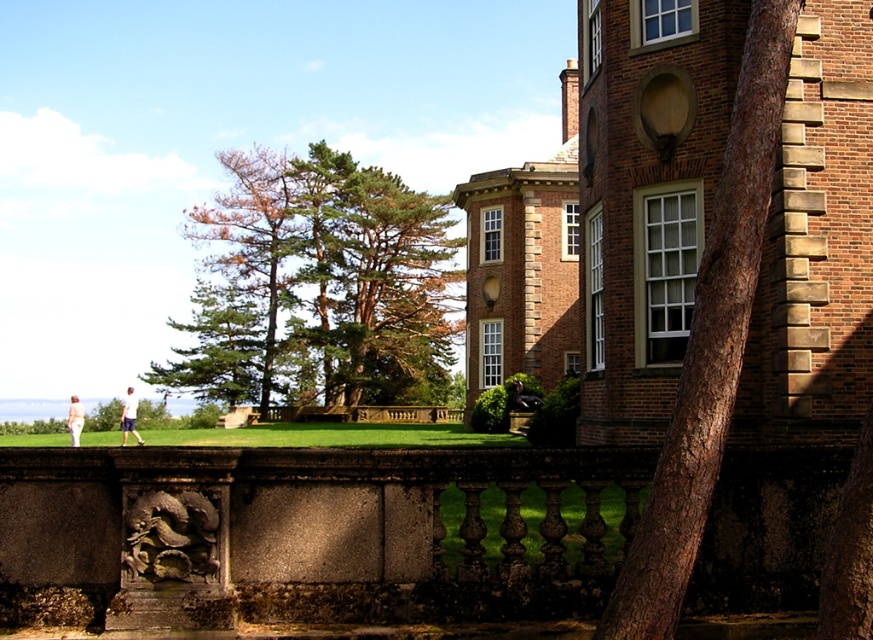
You are standing in front of the grand brick building and see the point at coordinates (129,417). Based on the scene description, can you determine what object this point is located on?

The point at coordinates (129,417) is located on the white cotton shirt at lower left.

From the picture: You are standing in front of the grand brick building and see the point at coordinates (521, 397). What object is this point located on?

The point at coordinates (521, 397) is located on the matte black statue at lower center.

You are a visitor standing in front of the grand brick building. You notice the matte black statue at lower center and the pink fabric pants at lower left. Which object is smaller in size?

The matte black statue at lower center is smaller in size compared to the pink fabric pants at lower left.